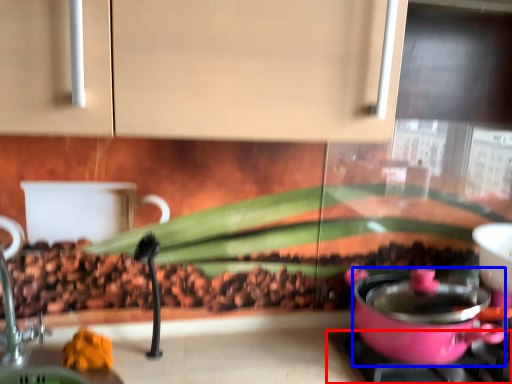
Question: Which point is closer to the camera, gas stove (highlighted by a red box) or kitchen appliance (highlighted by a blue box)?

Choices:
 (A) gas stove
 (B) kitchen appliance

Answer: (B)